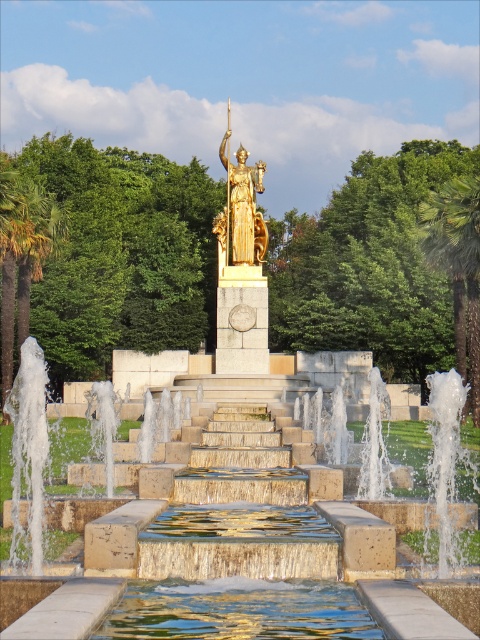
Question: Is clear glass water at center above green leafy palm tree at left?

Choices:
 (A) yes
 (B) no

Answer: (B)

Question: Which point is closer to the camera taking this photo?

Choices:
 (A) (252, 604)
 (B) (228, 124)
 (C) (469, 301)

Answer: (A)

Question: Which object is positioned closest to the green leafy palm tree at right?

Choices:
 (A) gold polished statue at center
 (B) clear glass water at center

Answer: (A)

Question: Which is nearer to the clear glass water at center?

Choices:
 (A) green leafy palm tree at right
 (B) gold polished statue at center
 (C) green leafy palm tree at left

Answer: (A)

Question: Is clear glass water at center wider than green leafy palm tree at left?

Choices:
 (A) yes
 (B) no

Answer: (B)

Question: Is the position of green leafy palm tree at left less distant than that of green leafy palm tree at right?

Choices:
 (A) no
 (B) yes

Answer: (A)